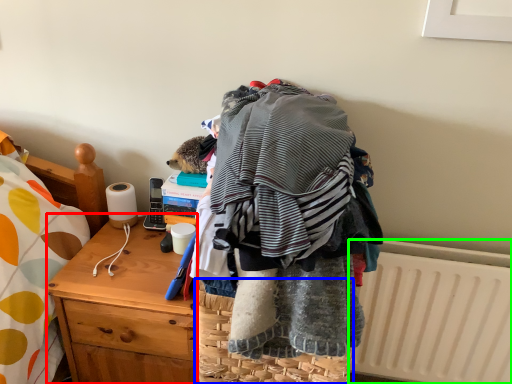
Question: Based on their relative distances, which object is farther from desk (highlighted by a red box)? Choose from picnic basket (highlighted by a blue box) and radiator (highlighted by a green box).

Choices:
 (A) picnic basket
 (B) radiator

Answer: (B)